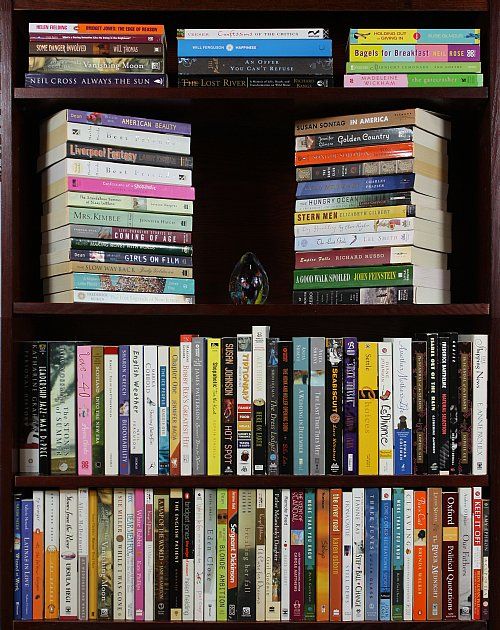
Find the location of `bookshelves`. bookshelves is located at coordinates (235, 94), (252, 307), (266, 482), (279, 622).